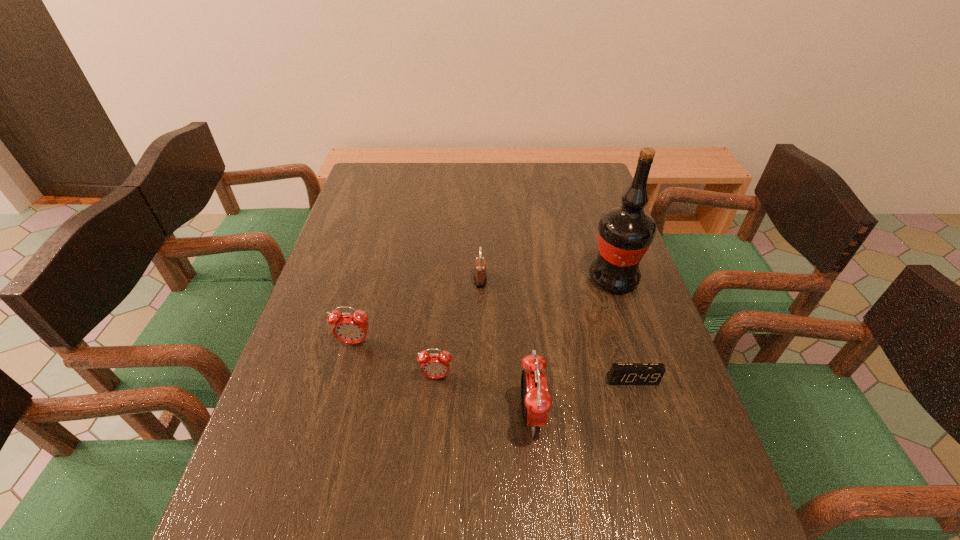
Find the location of a particular element. The image size is (960, 540). the leftmost alarm clock is located at coordinates (351, 328).

Identify the location of the leftmost object. The image size is (960, 540). (351, 328).

Identify the location of the second alarm clock from left to right. Image resolution: width=960 pixels, height=540 pixels. (434, 365).

Where is `the third tallest alarm clock`? The image size is (960, 540). the third tallest alarm clock is located at coordinates (434, 365).

This screenshot has width=960, height=540. In order to click on the nearest alarm clock in this screenshot , I will do `click(536, 401)`.

The image size is (960, 540). I want to click on the nearest object, so click(x=536, y=401).

You are a GUI agent. You are given a task and a screenshot of the screen. Output one action in this format:
    pyautogui.click(x=<x>, y=<y>)
    Task: Click on the padlock
    
    Given the screenshot: What is the action you would take?
    pyautogui.click(x=480, y=277)

Locate an element on the screen. This screenshot has height=540, width=960. the rightmost alarm clock is located at coordinates (620, 373).

The image size is (960, 540). Find the location of `the shortest object`. the shortest object is located at coordinates (620, 373).

The width and height of the screenshot is (960, 540). I want to click on wine bottle, so click(x=625, y=232).